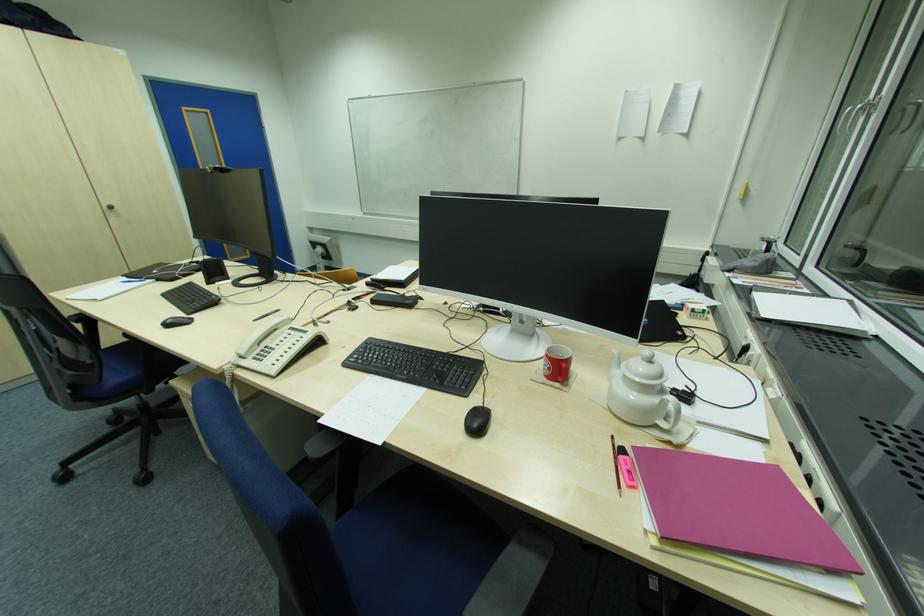
Find where to pull the silver cabinet knob. Please return your answer as a coordinate pair (x, y).

(110, 207)